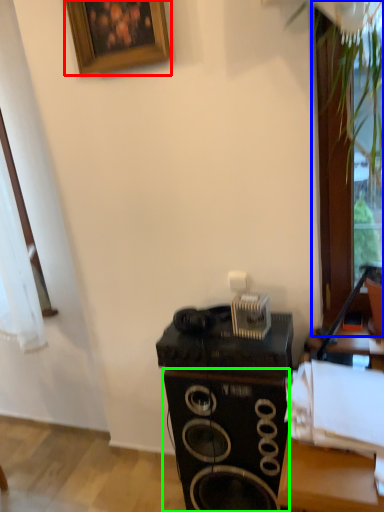
Question: Considering the real-world distances, which object is closest to picture frame (highlighted by a red box)? glass door (highlighted by a blue box) or speaker (highlighted by a green box).

Choices:
 (A) glass door
 (B) speaker

Answer: (A)